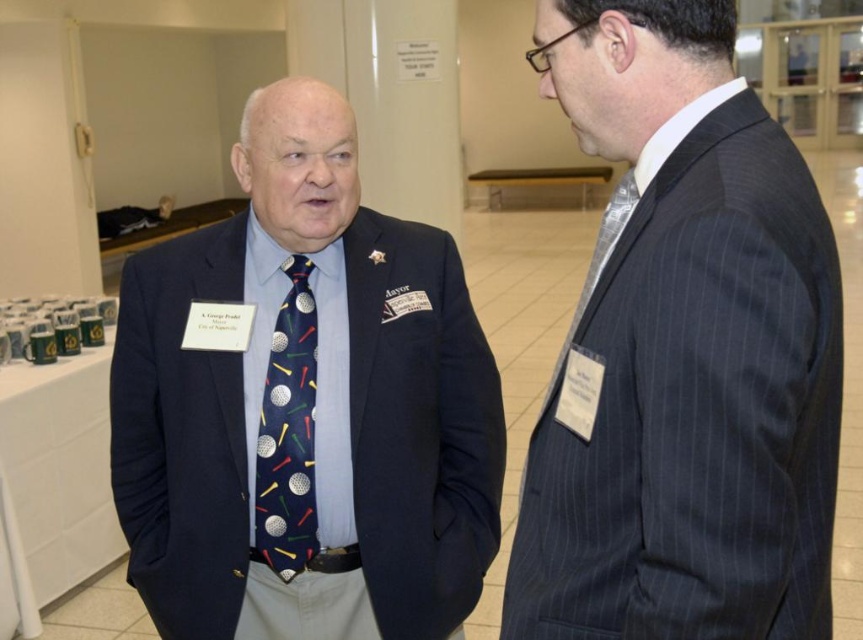
You are a photographer setting up for a group photo. You notice the navy blue suit at center and the navy fabric tie at center in the frame. Which object should you adjust to ensure both are in focus? Explain your reasoning.

The navy blue suit at center is closer to the viewer than the navy fabric tie at center. To ensure both are in focus, adjust the camera focus to account for the distance between them, possibly using a smaller aperture for a deeper depth of field or recompose so both are at a similar distance.

You are a photographer setting up for a group photo. You need to position two subjects wearing the navy blue suit at center and the silvery metallic tie at right so that they are side by side without overlapping. Based on their current positions, is there enough space between them to achieve this?

The navy blue suit at center might be wider than silvery metallic tie at right, so there may not be enough space between them to position them side by side without overlapping. Adjust their positions to ensure adequate spacing.